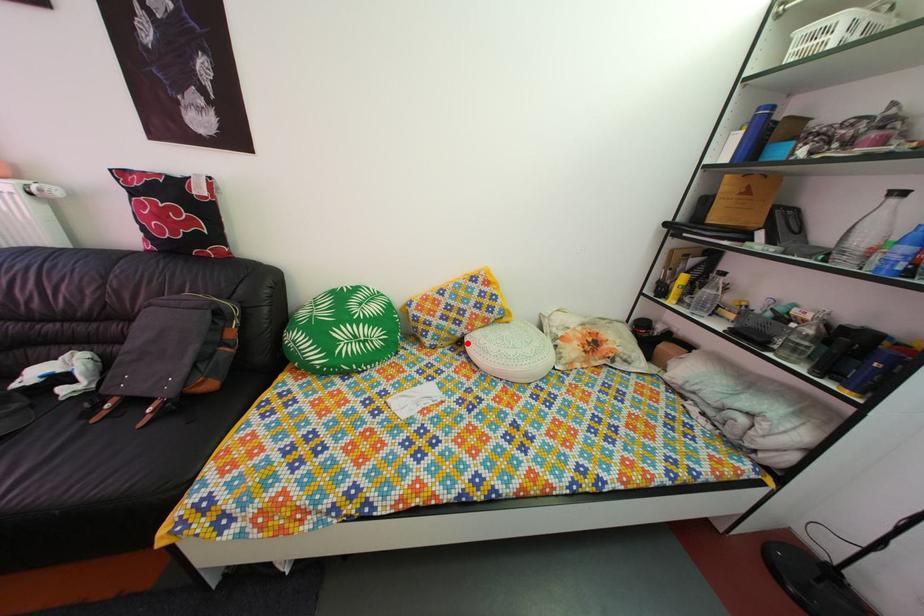
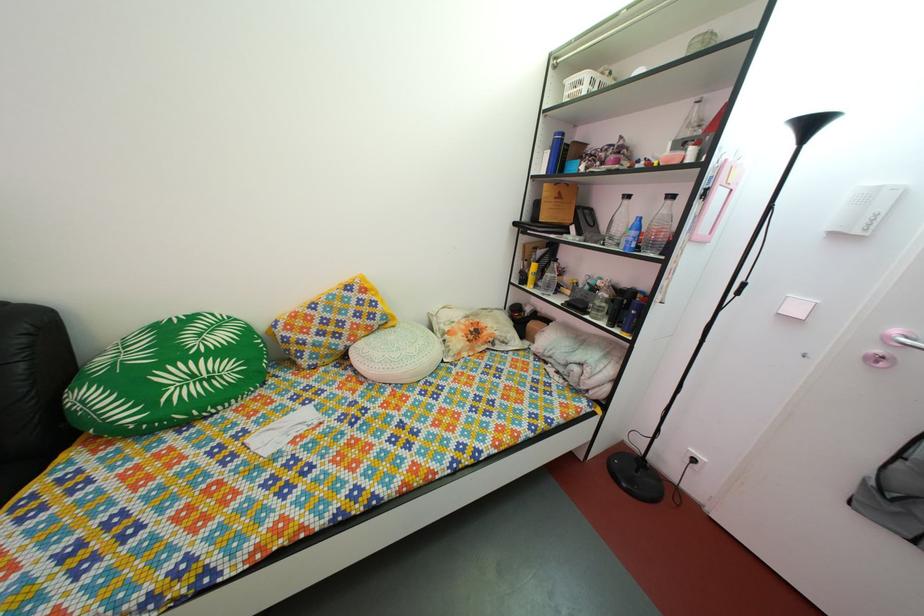
In the second image, find the point that corresponds to the highlighted location in the first image.

(349, 357)